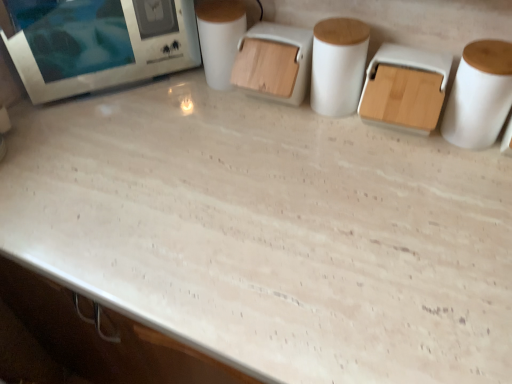
Question: Is wooden lid container at center inside the boundaries of white glossy microwave at upper left, or outside?

Choices:
 (A) inside
 (B) outside

Answer: (B)

Question: Is wooden lid container at center bigger or smaller than white glossy microwave at upper left?

Choices:
 (A) big
 (B) small

Answer: (B)

Question: Estimate the real-world distances between objects in this image. Which object is farther from the white matte toilet paper at center?

Choices:
 (A) wooden lid container at center
 (B) white matte paper towel at right, the 1th paper towel from the right
 (C) white matte paper towel at center, placed as the 1th paper towel when sorted from left to right
 (D) white glossy microwave at upper left

Answer: (B)

Question: Based on their relative distances, which object is nearer to the white matte toilet paper at center?

Choices:
 (A) white matte paper towel at center, which is counted as the second paper towel, starting from the right
 (B) white matte paper towel at right, the 1th paper towel from the right
 (C) white glossy microwave at upper left
 (D) wooden lid container at center

Answer: (D)